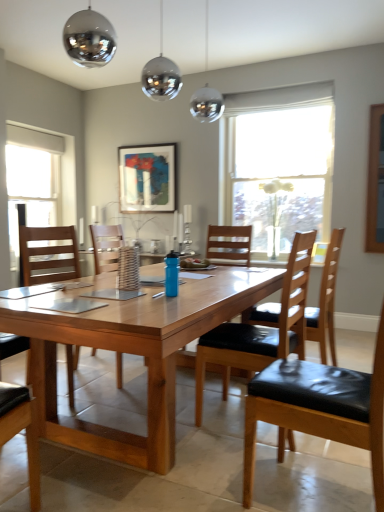
You are a GUI agent. You are given a task and a screenshot of the screen. Output one action in this format:
    pyautogui.click(x=<x>, y=<y>)
    Task: Click on the free space in front of black leather chair at center, arranged as the 3th chair when viewed from the right
    
    Given the screenshot: What is the action you would take?
    pyautogui.click(x=240, y=465)